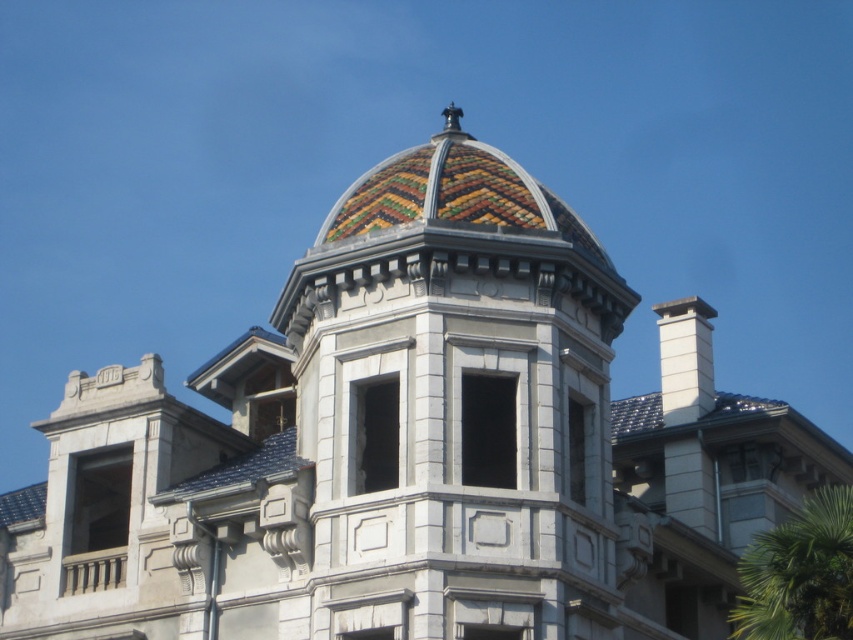
Question: Is multicolored mosaic dome at center above mosaic tile dome at center?

Choices:
 (A) yes
 (B) no

Answer: (B)

Question: Can you confirm if multicolored mosaic dome at center is smaller than mosaic tile dome at center?

Choices:
 (A) no
 (B) yes

Answer: (B)

Question: Which of these objects is positioned farthest from the mosaic tile dome at center?

Choices:
 (A) multicolored mosaic dome at center
 (B) green leafy palm tree at lower right

Answer: (B)

Question: Based on their relative distances, which object is nearer to the mosaic tile dome at center?

Choices:
 (A) green leafy palm tree at lower right
 (B) multicolored mosaic dome at center

Answer: (B)

Question: Which of the following is the farthest from the observer?

Choices:
 (A) (502, 344)
 (B) (560, 284)

Answer: (B)

Question: Is multicolored mosaic dome at center below mosaic tile dome at center?

Choices:
 (A) no
 (B) yes

Answer: (B)